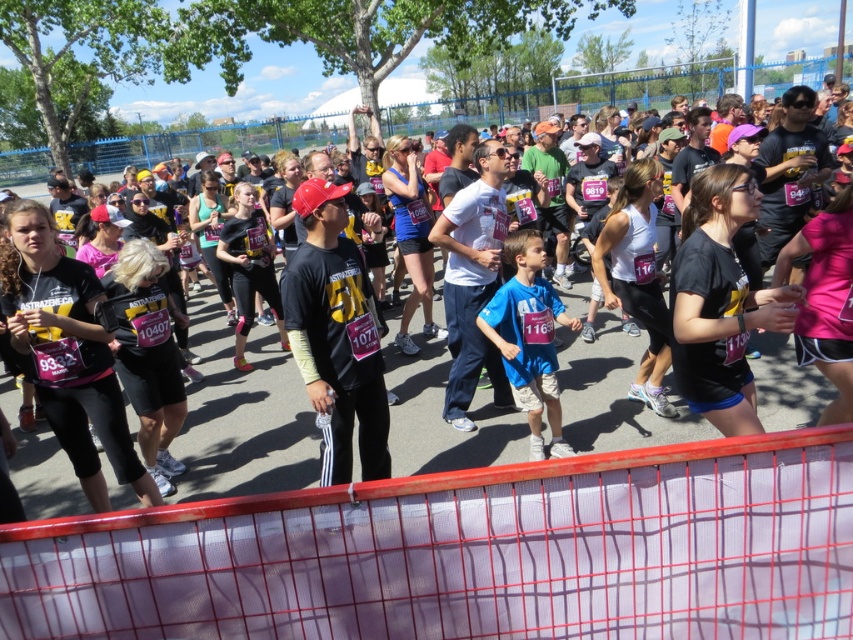
Question: Which of the following is the closest to the observer?

Choices:
 (A) black t-shirt at center
 (B) black matte shirt at left

Answer: (B)

Question: Does black t-shirt at center appear under black matte shirt at left?

Choices:
 (A) yes
 (B) no

Answer: (A)

Question: Is black t-shirt at center to the right of black matte shirt at left from the viewer's perspective?

Choices:
 (A) yes
 (B) no

Answer: (A)

Question: Which point is closer to the camera?

Choices:
 (A) (602, 342)
 (B) (51, 237)

Answer: (B)

Question: Which point is closer to the camera?

Choices:
 (A) (33, 497)
 (B) (123, 461)

Answer: (B)

Question: Can you confirm if black t-shirt at center is positioned to the left of black matte shirt at left?

Choices:
 (A) no
 (B) yes

Answer: (A)